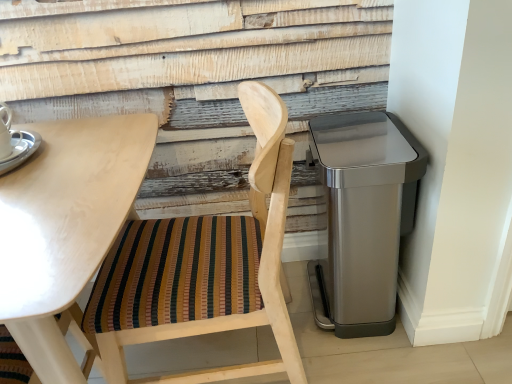
Question: From a real-world perspective, is satin silver trash can at right physically located above or below silver metallic saucer at upper left?

Choices:
 (A) above
 (B) below

Answer: (B)

Question: In the image, is satin silver trash can at right on the left side or the right side of silver metallic saucer at upper left?

Choices:
 (A) right
 (B) left

Answer: (A)

Question: Which object is positioned farthest from the silver metallic saucer at upper left?

Choices:
 (A) satin silver trash can at right
 (B) light wood table at upper left
 (C) wooden chair with striped cushion at left

Answer: (A)

Question: Which object is the closest to the wooden chair with striped cushion at left?

Choices:
 (A) satin silver trash can at right
 (B) light wood table at upper left
 (C) silver metallic saucer at upper left

Answer: (B)